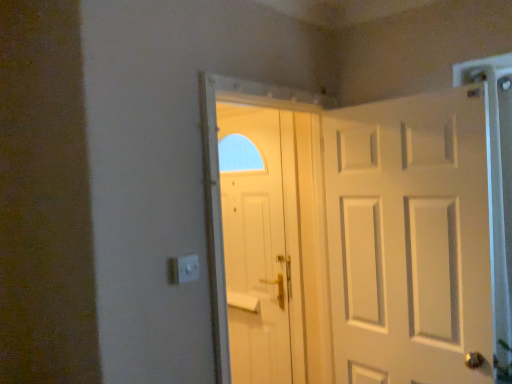
The width and height of the screenshot is (512, 384). What do you see at coordinates (255, 247) in the screenshot?
I see `white matte door at center, which ranks as the 2th door in front-to-back order` at bounding box center [255, 247].

The width and height of the screenshot is (512, 384). In order to click on white matte door at center, acting as the first door starting from the left in this screenshot , I will do `click(255, 247)`.

Measure the distance between point (268, 168) and camera.

Point (268, 168) is 8.00 feet away from camera.

Measure the distance between point (349, 368) and camera.

Point (349, 368) and camera are 2.06 meters apart.

What is the approximate width of white matte door at right, which is the 2th door from left to right?

white matte door at right, which is the 2th door from left to right, is 5.88 inches wide.

Image resolution: width=512 pixels, height=384 pixels. What do you see at coordinates (350, 237) in the screenshot? I see `white matte door at right, the 1th door viewed from the front` at bounding box center [350, 237].

Find the location of a particular element. white matte door at right, the 1th door viewed from the front is located at coordinates (350, 237).

Where is `white matte door at center, acting as the first door starting from the left`? This screenshot has width=512, height=384. white matte door at center, acting as the first door starting from the left is located at coordinates (x=255, y=247).

Can you confirm if white matte door at center, which ranks as the second door in right-to-left order, is positioned to the right of white matte door at right, the first door from the right?

Incorrect, white matte door at center, which ranks as the second door in right-to-left order, is not on the right side of white matte door at right, the first door from the right.

Relative to white matte door at right, the 2th door in the back-to-front sequence, is white matte door at center, placed as the first door when sorted from back to front, in front or behind?

In the image, white matte door at center, placed as the first door when sorted from back to front, appears behind white matte door at right, the 2th door in the back-to-front sequence.

Is point (276, 262) positioned in front of point (421, 221)?

That is False.

Based on the photo, from the image's perspective, is white matte door at center, acting as the first door starting from the left, on white matte door at right, the 2th door in the back-to-front sequence?

No, from the image's perspective, white matte door at center, acting as the first door starting from the left, is not on top of white matte door at right, the 2th door in the back-to-front sequence.

From a real-world perspective, which is physically below, white matte door at center, acting as the first door starting from the left, or white matte door at right, the 1th door viewed from the front?

white matte door at center, acting as the first door starting from the left.

Which object is thinner, white matte door at center, placed as the first door when sorted from back to front, or white matte door at right, the 2th door in the back-to-front sequence?

white matte door at center, placed as the first door when sorted from back to front.

Considering the relative sizes of white matte door at center, acting as the first door starting from the left, and white matte door at right, the 2th door in the back-to-front sequence, in the image provided, is white matte door at center, acting as the first door starting from the left, shorter than white matte door at right, the 2th door in the back-to-front sequence,?

No, white matte door at center, acting as the first door starting from the left, is not shorter than white matte door at right, the 2th door in the back-to-front sequence.

Looking at this image, considering the sizes of white matte door at center, acting as the first door starting from the left, and white matte door at right, the first door from the right, in the image, is white matte door at center, acting as the first door starting from the left, bigger or smaller than white matte door at right, the first door from the right,?

white matte door at center, acting as the first door starting from the left, is smaller than white matte door at right, the first door from the right.

Does white matte door at center, placed as the first door when sorted from back to front, contain white matte door at right, which is the 2th door from left to right?

Definitely not — white matte door at right, which is the 2th door from left to right, is not inside white matte door at center, placed as the first door when sorted from back to front.

Is white matte door at center, placed as the first door when sorted from back to front, not near white matte door at right, the first door from the right?

No, white matte door at center, placed as the first door when sorted from back to front, is not far from white matte door at right, the first door from the right.

Is white matte door at center, acting as the first door starting from the left, oriented away from white matte door at right, the 2th door in the back-to-front sequence?

No.

At what (x,y) coordinates should I click in order to perform the action: click on door in front of the white matte door at center, which ranks as the second door in right-to-left order. Please return your answer as a coordinate pair (x, y). Image resolution: width=512 pixels, height=384 pixels. Looking at the image, I should click on (350, 237).

Looking at this image, considering the positions of objects white matte door at right, the first door from the right, and white matte door at center, placed as the first door when sorted from back to front, in the image provided, who is more to the left, white matte door at right, the first door from the right, or white matte door at center, placed as the first door when sorted from back to front,?

white matte door at center, placed as the first door when sorted from back to front.

Is the position of white matte door at right, the first door from the right, less distant than that of white matte door at center, which ranks as the 2th door in front-to-back order?

Yes, white matte door at right, the first door from the right, is closer to the viewer.

Between point (206, 169) and point (234, 105), which one is positioned in front?

The point (206, 169) is closer.

From the image's perspective, is white matte door at right, the 1th door viewed from the front, positioned above or below white matte door at center, which ranks as the second door in right-to-left order?

white matte door at right, the 1th door viewed from the front, is situated higher than white matte door at center, which ranks as the second door in right-to-left order, in the image.

From a real-world perspective, between white matte door at right, which is the 2th door from left to right, and white matte door at center, placed as the first door when sorted from back to front, who is vertically lower?

white matte door at center, placed as the first door when sorted from back to front.

Is white matte door at right, which is the 2th door from left to right, wider or thinner than white matte door at center, which ranks as the second door in right-to-left order?

white matte door at right, which is the 2th door from left to right, is wider than white matte door at center, which ranks as the second door in right-to-left order.

Considering the relative sizes of white matte door at right, which is the 2th door from left to right, and white matte door at center, which ranks as the 2th door in front-to-back order, in the image provided, is white matte door at right, which is the 2th door from left to right, shorter than white matte door at center, which ranks as the 2th door in front-to-back order,?

Correct, white matte door at right, which is the 2th door from left to right, is not as tall as white matte door at center, which ranks as the 2th door in front-to-back order.

Between white matte door at right, the 2th door in the back-to-front sequence, and white matte door at center, acting as the first door starting from the left, which one has smaller size?

With smaller size is white matte door at center, acting as the first door starting from the left.

Would you say white matte door at right, the first door from the right, is inside or outside white matte door at center, which ranks as the 2th door in front-to-back order?

white matte door at right, the first door from the right, cannot be found inside white matte door at center, which ranks as the 2th door in front-to-back order.

Is white matte door at right, the first door from the right, not close to white matte door at center, which ranks as the 2th door in front-to-back order?

They are positioned close to each other.

Is white matte door at right, which is the 2th door from left to right, positioned with its back to white matte door at center, which ranks as the second door in right-to-left order?

That's not correct — white matte door at right, which is the 2th door from left to right, is not looking away from white matte door at center, which ranks as the second door in right-to-left order.

The height and width of the screenshot is (384, 512). I want to click on door lying on the left of white matte door at right, which is the 2th door from left to right, so click(255, 247).

Where is `door on the right of white matte door at center, acting as the first door starting from the left`? Image resolution: width=512 pixels, height=384 pixels. door on the right of white matte door at center, acting as the first door starting from the left is located at coordinates (350, 237).

Identify the location of door above the white matte door at center, which ranks as the 2th door in front-to-back order (from a real-world perspective). The width and height of the screenshot is (512, 384). (350, 237).